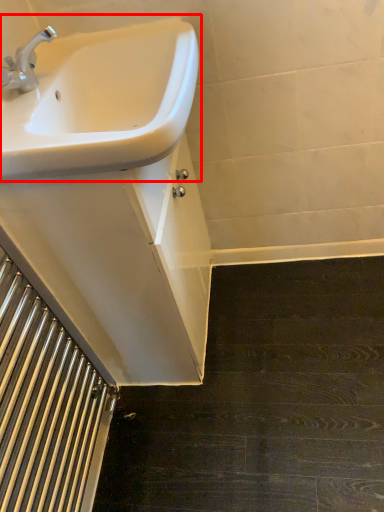
Question: Observing the image, what is the correct spatial positioning of sink (annotated by the red box) in reference to stairwell?

Choices:
 (A) right
 (B) left

Answer: (A)